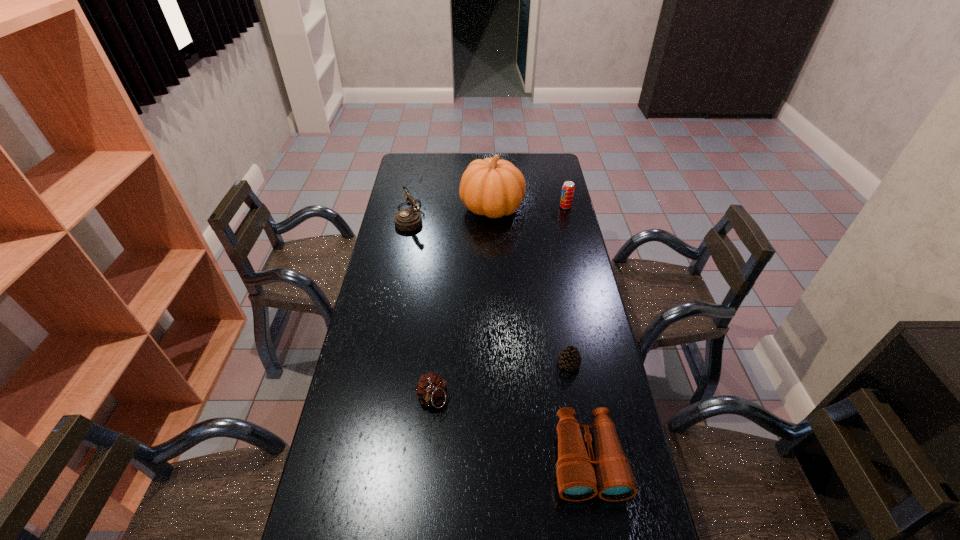
The height and width of the screenshot is (540, 960). Identify the location of empty location between the soda can and the nearer pinecone. (498, 303).

The height and width of the screenshot is (540, 960). In order to click on the third closest object relative to the telephone in this screenshot , I will do `click(431, 389)`.

Identify which object is the nearest to the nearest object. Please provide its 2D coordinates. Your answer should be formatted as a tuple, i.e. [(x, y)], where the tuple contains the x and y coordinates of a point satisfying the conditions above.

[(569, 358)]

Identify the location of vacant space that satisfies the following two spatial constraints: 1. on the back side of the telephone; 2. on the right side of the soda can. This screenshot has width=960, height=540. (412, 207).